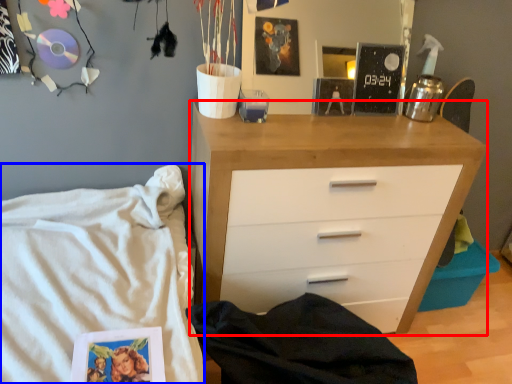
Question: Which object is further to the camera taking this photo, chest of drawers (highlighted by a red box) or bed (highlighted by a blue box)?

Choices:
 (A) chest of drawers
 (B) bed

Answer: (A)